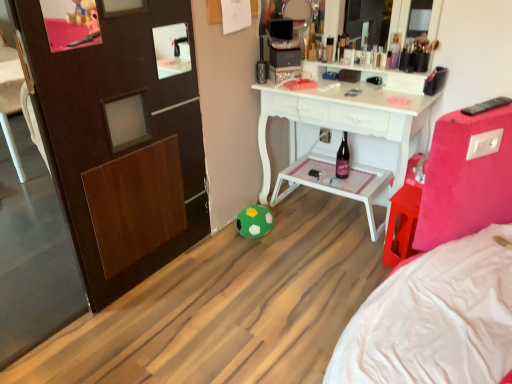
This screenshot has height=384, width=512. What do you see at coordinates (329, 49) in the screenshot?
I see `metallic silver toiletry at center, the first toiletry from the left` at bounding box center [329, 49].

Identify the location of metallic silver toiletry at center, acting as the second toiletry starting from the right. (329, 49).

What do you see at coordinates (341, 46) in the screenshot?
I see `metallic silver toiletries at upper center, which appears as the 2th toiletry when viewed from the left` at bounding box center [341, 46].

Locate an element on the screen. This screenshot has width=512, height=384. dark glass bottle at center is located at coordinates (343, 159).

From a real-world perspective, which object rests below the other?

dark glass bottle at center, from a real-world perspective.

Which is closer, (339,178) or (330,60)?

→ The point (330,60) is closer.

Is dark glass bottle at center at the left side of metallic silver toiletry at center, acting as the second toiletry starting from the right?

Incorrect, dark glass bottle at center is not on the left side of metallic silver toiletry at center, acting as the second toiletry starting from the right.

Looking at their sizes, would you say dark glass bottle at center is wider or thinner than metallic silver toiletry at center, acting as the second toiletry starting from the right?

Clearly, dark glass bottle at center has more width compared to metallic silver toiletry at center, acting as the second toiletry starting from the right.

In the scene shown: Considering the sizes of objects dark glass bottle at center and black plastic remote control at upper right in the image provided, who is thinner, dark glass bottle at center or black plastic remote control at upper right?

With smaller width is dark glass bottle at center.

Considering the sizes of objects dark glass bottle at center and black plastic remote control at upper right in the image provided, who is bigger, dark glass bottle at center or black plastic remote control at upper right?

Bigger between the two is dark glass bottle at center.

This screenshot has width=512, height=384. I want to click on bottle to the left of black plastic remote control at upper right, so click(x=343, y=159).

Based on the photo, from the image's perspective, is dark glass bottle at center on top of black plastic remote control at upper right?

No.

Considering the relative sizes of metallic silver toiletry at center, the first toiletry from the left, and metallic silver toiletries at upper center, which appears as the 2th toiletry when viewed from the left, in the image provided, is metallic silver toiletry at center, the first toiletry from the left, bigger than metallic silver toiletries at upper center, which appears as the 2th toiletry when viewed from the left,?

Actually, metallic silver toiletry at center, the first toiletry from the left, might be smaller than metallic silver toiletries at upper center, which appears as the 2th toiletry when viewed from the left.

From a real-world perspective, is metallic silver toiletry at center, acting as the second toiletry starting from the right, on metallic silver toiletries at upper center, placed as the 1th toiletry when sorted from right to left?

Incorrect, from a real-world perspective, metallic silver toiletry at center, acting as the second toiletry starting from the right, is lower than metallic silver toiletries at upper center, placed as the 1th toiletry when sorted from right to left.

Could you tell me if metallic silver toiletry at center, acting as the second toiletry starting from the right, is turned towards metallic silver toiletries at upper center, placed as the 1th toiletry when sorted from right to left?

No.

Find the location of `toiletry below the metallic silver toiletries at upper center, which appears as the 2th toiletry when viewed from the left (from a real-world perspective)`. toiletry below the metallic silver toiletries at upper center, which appears as the 2th toiletry when viewed from the left (from a real-world perspective) is located at coordinates (329, 49).

Which of these two, metallic silver toiletry at center, acting as the second toiletry starting from the right, or green felt ball at lower center, is bigger?

With larger size is green felt ball at lower center.

Who is taller, metallic silver toiletry at center, the first toiletry from the left, or green felt ball at lower center?

green felt ball at lower center.

Is point (330, 41) behind point (259, 220)?

Yes, point (330, 41) is behind point (259, 220).

Is metallic silver toiletry at center, acting as the second toiletry starting from the right, oriented away from green felt ball at lower center?

No, metallic silver toiletry at center, acting as the second toiletry starting from the right, is not facing the opposite direction of green felt ball at lower center.

Would you consider metallic silver toiletries at upper center, which appears as the 2th toiletry when viewed from the left, to be distant from metallic silver toiletry at center, the first toiletry from the left?

They are positioned close to each other.

In terms of height, does metallic silver toiletries at upper center, placed as the 1th toiletry when sorted from right to left, look taller or shorter compared to metallic silver toiletry at center, acting as the second toiletry starting from the right?

Clearly, metallic silver toiletries at upper center, placed as the 1th toiletry when sorted from right to left, is taller compared to metallic silver toiletry at center, acting as the second toiletry starting from the right.

Is metallic silver toiletries at upper center, placed as the 1th toiletry when sorted from right to left, to the left of metallic silver toiletry at center, acting as the second toiletry starting from the right, from the viewer's perspective?

No.

Is metallic silver toiletry at center, the first toiletry from the left, at the back of metallic silver toiletries at upper center, placed as the 1th toiletry when sorted from right to left?

No, metallic silver toiletries at upper center, placed as the 1th toiletry when sorted from right to left, is not facing the opposite direction of metallic silver toiletry at center, the first toiletry from the left.

Is black plastic remote control at upper right at the right side of metallic silver toiletries at upper center, placed as the 1th toiletry when sorted from right to left?

Indeed, black plastic remote control at upper right is positioned on the right side of metallic silver toiletries at upper center, placed as the 1th toiletry when sorted from right to left.

What's the angular difference between black plastic remote control at upper right and metallic silver toiletries at upper center, which appears as the 2th toiletry when viewed from the left,'s facing directions?

The facing directions of black plastic remote control at upper right and metallic silver toiletries at upper center, which appears as the 2th toiletry when viewed from the left, are 21.1 degrees apart.

Would you consider black plastic remote control at upper right to be distant from metallic silver toiletries at upper center, which appears as the 2th toiletry when viewed from the left?

black plastic remote control at upper right is far away from metallic silver toiletries at upper center, which appears as the 2th toiletry when viewed from the left.

Is metallic silver toiletry at center, the first toiletry from the left, oriented away from black plastic remote control at upper right?

No, metallic silver toiletry at center, the first toiletry from the left, is not facing the opposite direction of black plastic remote control at upper right.

Can you confirm if metallic silver toiletry at center, the first toiletry from the left, is positioned to the right of black plastic remote control at upper right?

No.

Is metallic silver toiletry at center, the first toiletry from the left, far away from black plastic remote control at upper right?

Yes, metallic silver toiletry at center, the first toiletry from the left, and black plastic remote control at upper right are located far from each other.

Considering the relative sizes of metallic silver toiletry at center, the first toiletry from the left, and black plastic remote control at upper right in the image provided, is metallic silver toiletry at center, the first toiletry from the left, bigger than black plastic remote control at upper right?

Actually, metallic silver toiletry at center, the first toiletry from the left, might be smaller than black plastic remote control at upper right.

The width and height of the screenshot is (512, 384). I want to click on bottle behind the metallic silver toiletry at center, the first toiletry from the left, so click(343, 159).

The width and height of the screenshot is (512, 384). I want to click on bottle below the black plastic remote control at upper right (from the image's perspective), so click(x=343, y=159).

Based on the photo, considering their positions, is metallic silver toiletry at center, acting as the second toiletry starting from the right, positioned closer to dark glass bottle at center than white plastic tray at center?

Based on the image, white plastic tray at center appears to be nearer to dark glass bottle at center.

Considering their positions, is green felt ball at lower center positioned further to dark glass bottle at center than white plastic tray at center?

Based on the image, green felt ball at lower center appears to be further to dark glass bottle at center.

Based on their spatial positions, is metallic silver toiletry at center, the first toiletry from the left, or black plastic remote control at upper right closer to green felt ball at lower center?

metallic silver toiletry at center, the first toiletry from the left, is positioned closer to the anchor green felt ball at lower center.

Based on their spatial positions, is green felt ball at lower center or metallic silver toiletry at center, acting as the second toiletry starting from the right, further from white plastic tray at center?

metallic silver toiletry at center, acting as the second toiletry starting from the right.

From the image, which object appears to be nearer to black plastic remote control at upper right, dark glass bottle at center or metallic silver toiletries at upper center, which appears as the 2th toiletry when viewed from the left?

Based on the image, metallic silver toiletries at upper center, which appears as the 2th toiletry when viewed from the left, appears to be nearer to black plastic remote control at upper right.

Which object lies nearer to the anchor point green felt ball at lower center, black plastic remote control at upper right or metallic silver toiletries at upper center, which appears as the 2th toiletry when viewed from the left?

Based on the image, metallic silver toiletries at upper center, which appears as the 2th toiletry when viewed from the left, appears to be nearer to green felt ball at lower center.

Estimate the real-world distances between objects in this image. Which object is further from metallic silver toiletry at center, the first toiletry from the left, dark glass bottle at center or green felt ball at lower center?

green felt ball at lower center lies further to metallic silver toiletry at center, the first toiletry from the left, than the other object.

Based on their spatial positions, is metallic silver toiletry at center, the first toiletry from the left, or black plastic remote control at upper right closer to white plastic tray at center?

Among the two, metallic silver toiletry at center, the first toiletry from the left, is located nearer to white plastic tray at center.

Where is `toiletry positioned between black plastic remote control at upper right and metallic silver toiletry at center, the first toiletry from the left, from near to far`? toiletry positioned between black plastic remote control at upper right and metallic silver toiletry at center, the first toiletry from the left, from near to far is located at coordinates (341, 46).

Find the location of a particular element. This screenshot has height=384, width=512. bottle that lies between metallic silver toiletries at upper center, which appears as the 2th toiletry when viewed from the left, and green felt ball at lower center from top to bottom is located at coordinates (343, 159).

This screenshot has height=384, width=512. Find the location of `toy between black plastic remote control at upper right and dark glass bottle at center in the front-back direction`. toy between black plastic remote control at upper right and dark glass bottle at center in the front-back direction is located at coordinates (254, 221).

In order to click on toiletry between metallic silver toiletries at upper center, placed as the 1th toiletry when sorted from right to left, and white plastic tray at center in the up-down direction in this screenshot , I will do `click(329, 49)`.